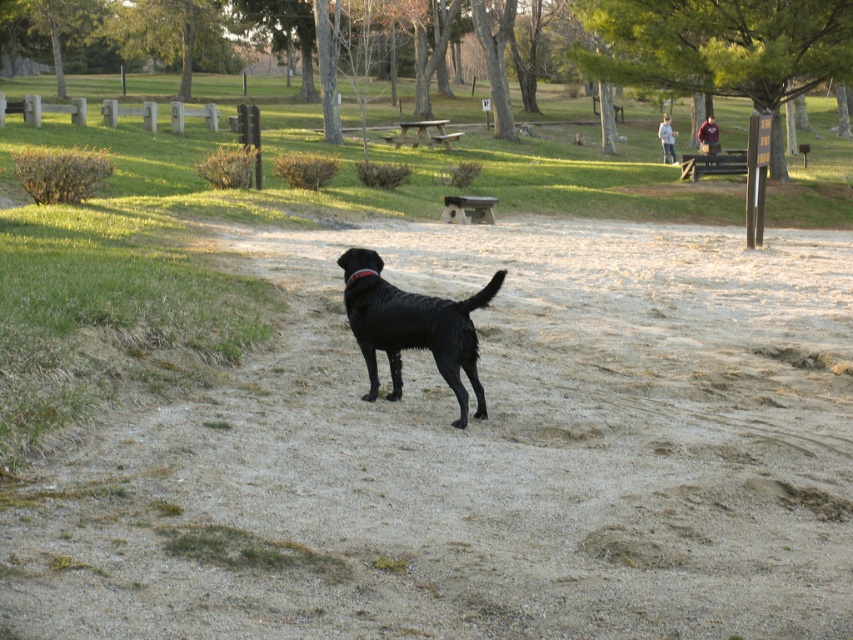
Question: Can you confirm if sandy textured dog at center is positioned to the right of shiny black dog at center?

Choices:
 (A) yes
 (B) no

Answer: (A)

Question: Which object is farther from the camera taking this photo?

Choices:
 (A) shiny black dog at center
 (B) sandy textured dog at center

Answer: (A)

Question: Does sandy textured dog at center appear over shiny black dog at center?

Choices:
 (A) yes
 (B) no

Answer: (A)

Question: Is sandy textured dog at center in front of shiny black dog at center?

Choices:
 (A) no
 (B) yes

Answer: (B)

Question: Which of the following is the closest to the observer?

Choices:
 (A) shiny black dog at center
 (B) sandy textured dog at center

Answer: (B)

Question: Among these points, which one is farthest from the camera?

Choices:
 (A) pyautogui.click(x=407, y=291)
 (B) pyautogui.click(x=392, y=593)

Answer: (A)